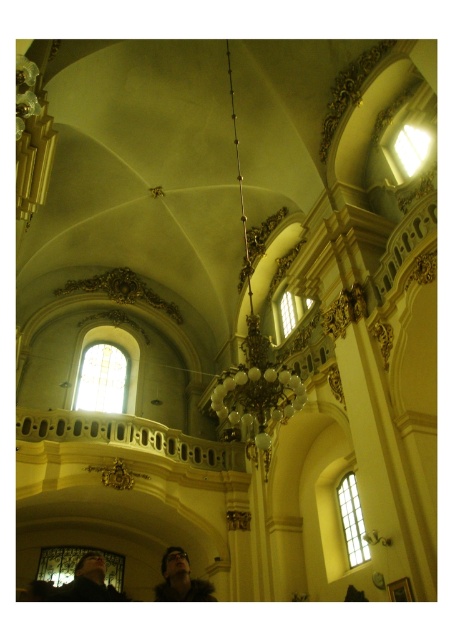
Question: Can you confirm if dark brown hair at lower center is bigger than dark brown leather jacket at lower left?

Choices:
 (A) yes
 (B) no

Answer: (B)

Question: Which point is closer to the camera?

Choices:
 (A) (186, 589)
 (B) (110, 589)

Answer: (A)

Question: Which of the following is the closest to the observer?

Choices:
 (A) dark brown leather jacket at lower left
 (B) dark brown hair at lower center

Answer: (A)

Question: Is the position of dark brown hair at lower center less distant than that of dark brown leather jacket at lower left?

Choices:
 (A) no
 (B) yes

Answer: (A)

Question: Where is dark brown hair at lower center located in relation to dark brown leather jacket at lower left in the image?

Choices:
 (A) right
 (B) left

Answer: (A)